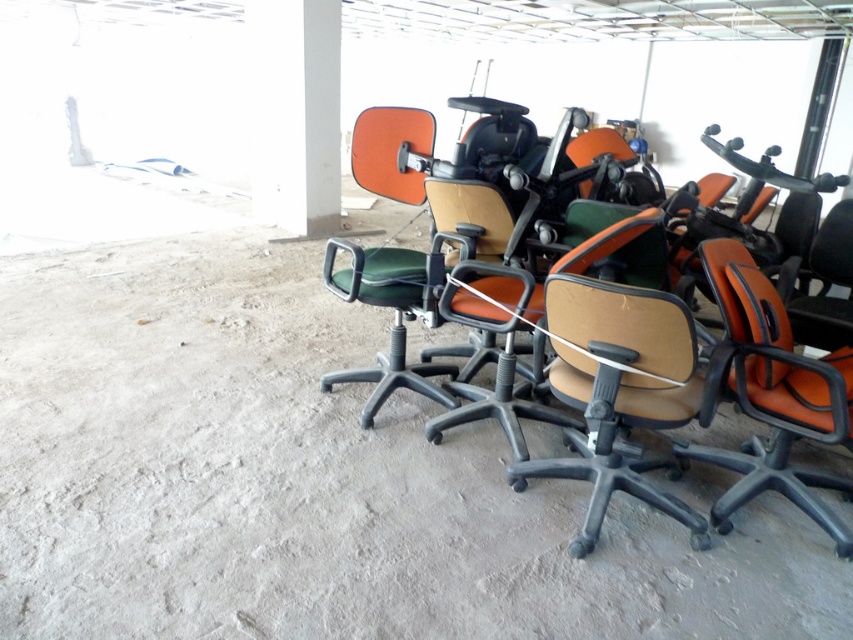
Question: Which object is farther from the camera taking this photo?

Choices:
 (A) brown fabric office chair at center
 (B) orange leather swivel chair at center
 (C) green fabric office chair at center

Answer: (C)

Question: Which of these objects is positioned farthest from the green fabric office chair at center?

Choices:
 (A) brown fabric office chair at center
 (B) beige fabric swivel chair at center

Answer: (B)

Question: Does brown fabric office chair at center come behind beige fabric swivel chair at center?

Choices:
 (A) yes
 (B) no

Answer: (A)

Question: Can you confirm if brown fabric office chair at center is positioned to the left of green fabric office chair at center?

Choices:
 (A) yes
 (B) no

Answer: (B)

Question: Which object is closer to the camera taking this photo?

Choices:
 (A) orange leather swivel chair at center
 (B) green fabric office chair at center
 (C) brown fabric office chair at center

Answer: (C)

Question: Does orange leather swivel chair at center appear under green fabric office chair at center?

Choices:
 (A) yes
 (B) no

Answer: (A)